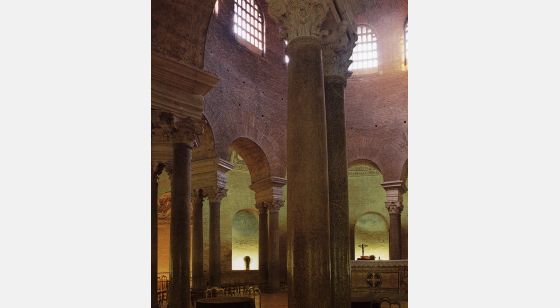
Where is `window`? This screenshot has width=560, height=308. window is located at coordinates (250, 34).